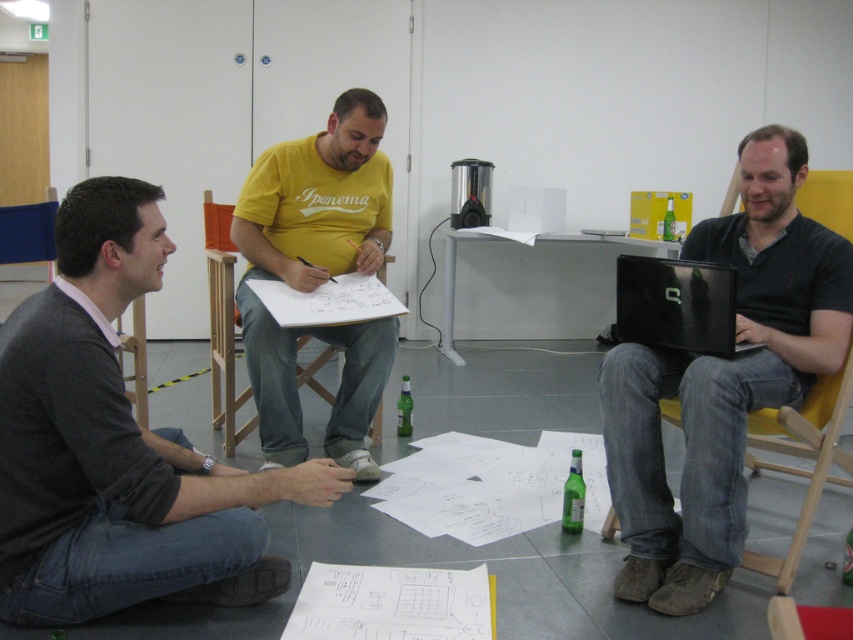
Question: Which of the following is the closest to the observer?

Choices:
 (A) (733, 225)
 (B) (618, 298)

Answer: (B)

Question: Which of the following is the farthest from the observer?

Choices:
 (A) (264, 417)
 (B) (688, 278)
 (C) (103, 369)
 (D) (512, 243)

Answer: (D)

Question: Is dark gray sweater at lower left above yellow cotton shirt at center?

Choices:
 (A) no
 (B) yes

Answer: (A)

Question: Is yellow cotton shirt at center below white plastic table at center?

Choices:
 (A) yes
 (B) no

Answer: (A)

Question: Considering the real-world distances, which object is farthest from the white plastic table at center?

Choices:
 (A) yellow cotton shirt at center
 (B) matte black laptop at right
 (C) dark gray sweater at lower left
 (D) black glossy laptop at right

Answer: (C)

Question: Where is dark gray sweater at lower left located in relation to white plastic table at center in the image?

Choices:
 (A) right
 (B) left

Answer: (B)